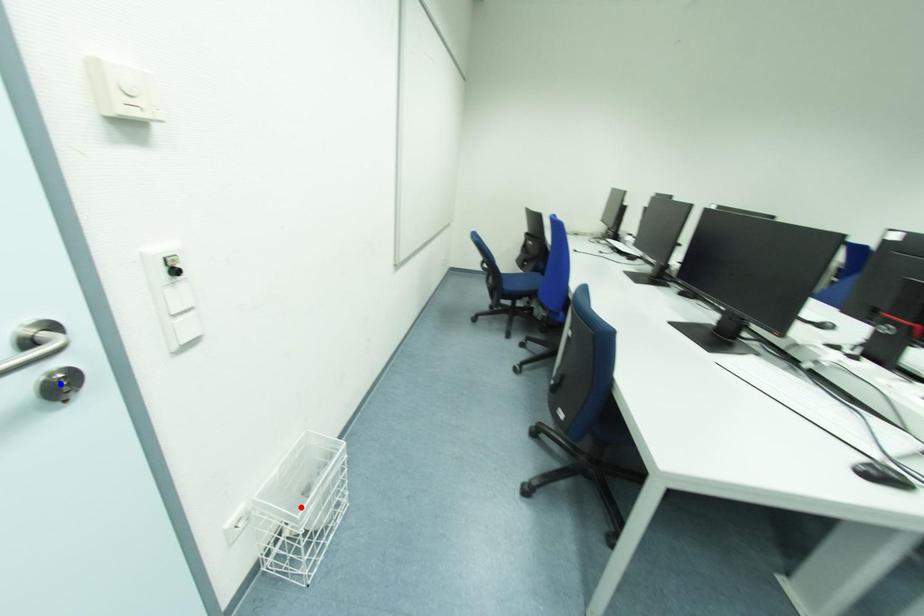
Question: Two points are marked on the image. Which point is closer to the camera?

Choices:
 (A) Blue point is closer.
 (B) Red point is closer.

Answer: (A)